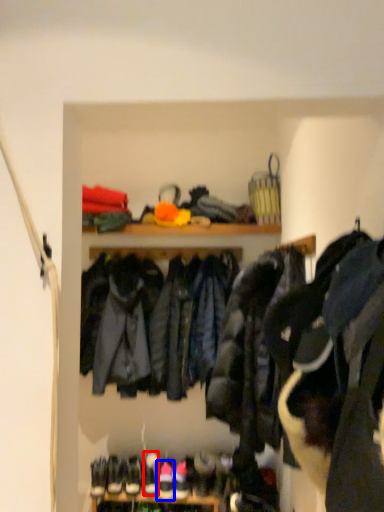
Question: Which object appears farthest to the camera in this image, footwear (highlighted by a red box) or footwear (highlighted by a blue box)?

Choices:
 (A) footwear
 (B) footwear

Answer: (A)